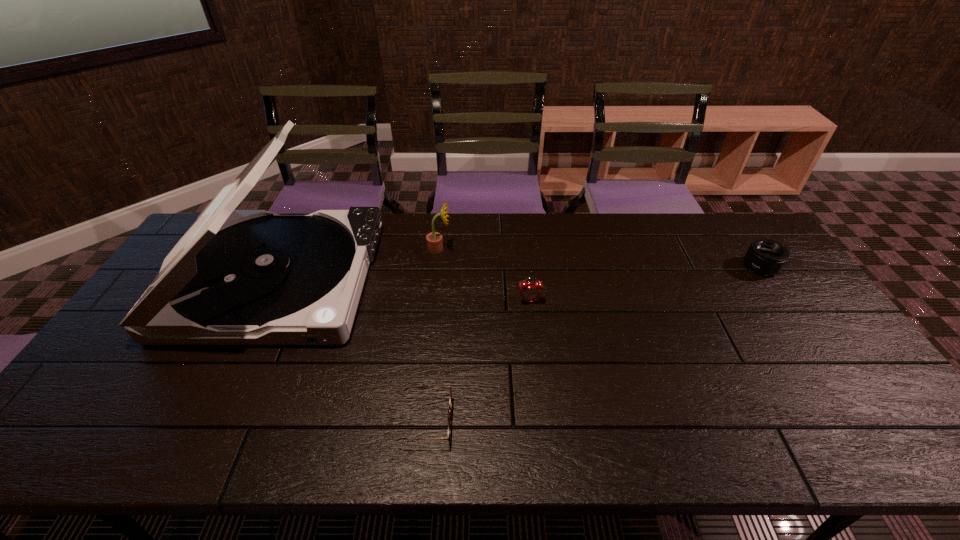
Image resolution: width=960 pixels, height=540 pixels. I want to click on the tallest object, so click(236, 277).

This screenshot has width=960, height=540. Identify the location of the leftmost object. (236, 277).

The height and width of the screenshot is (540, 960). Find the location of `sunflower`. sunflower is located at coordinates (434, 240).

Where is `the third tallest object`? The image size is (960, 540). the third tallest object is located at coordinates (530, 291).

Locate an element on the screen. alarm clock is located at coordinates (530, 291).

This screenshot has width=960, height=540. Identify the location of the rightmost object. (764, 256).

Image resolution: width=960 pixels, height=540 pixels. Identify the location of telephoto lens. (764, 256).

This screenshot has height=540, width=960. I want to click on the nearest object, so click(x=450, y=402).

At what (x,y) coordinates should I click in order to perform the action: click on the shortest object. Please return your answer as a coordinate pair (x, y). This screenshot has width=960, height=540. Looking at the image, I should click on (450, 402).

What are the coordinates of `vacant space located 0.340m on the control panel of the tallest object` in the screenshot? It's located at (480, 279).